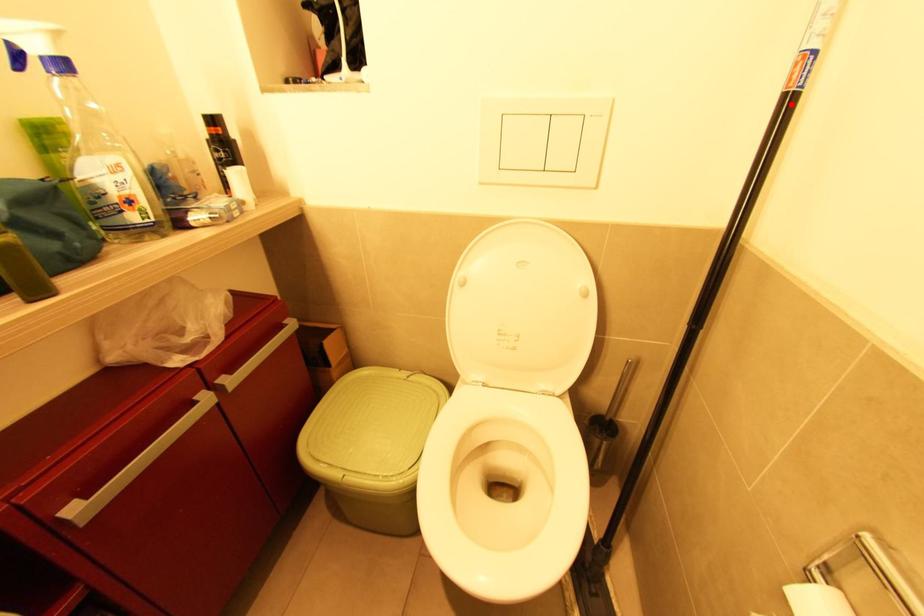
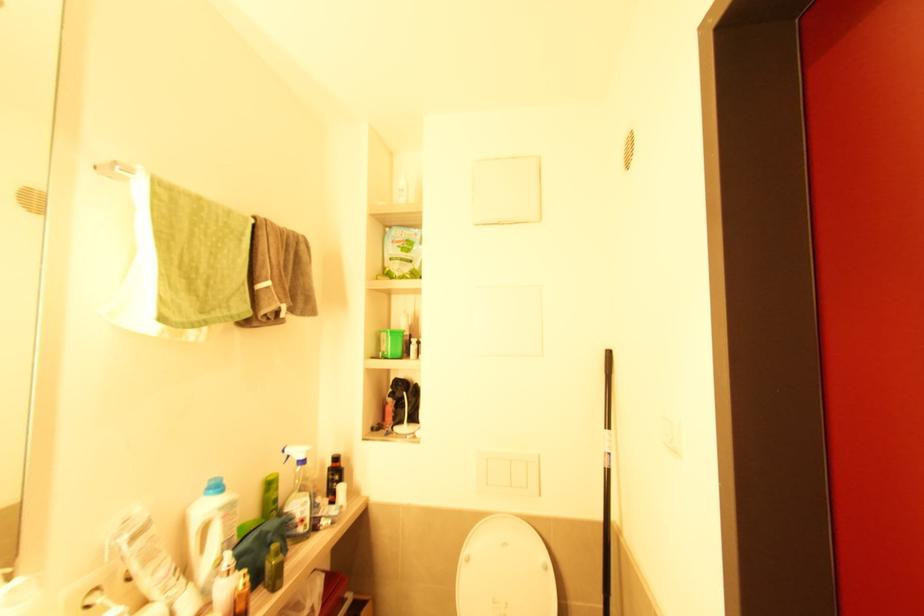
Locate, in the second image, the point that corresponds to the highlighted location in the first image.

(610, 472)